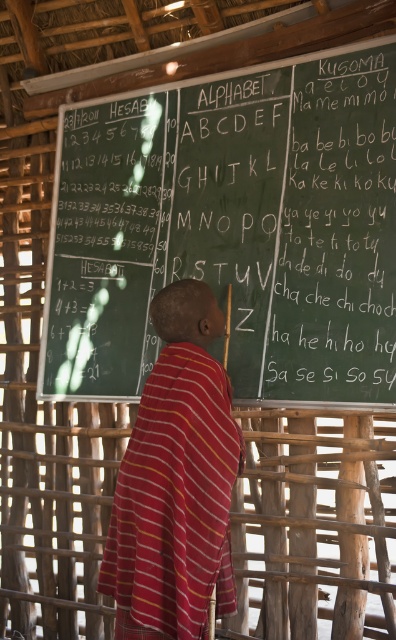
You are a student in the classroom who wants to write on the green chalkboard at upper center but is wearing the striped cotton robe at center. Will the robe interfere with your ability to reach the chalkboard?

The green chalkboard at upper center is much taller than the striped cotton robe at center, so the robe will not interfere with reaching the chalkboard.

You are a student in the classroom and need to write on the green chalkboard at upper center. Where should you stand to write on it effectively?

You should stand near the green chalkboard at upper center to write effectively, as it is located at point (232, 227) in the classroom.